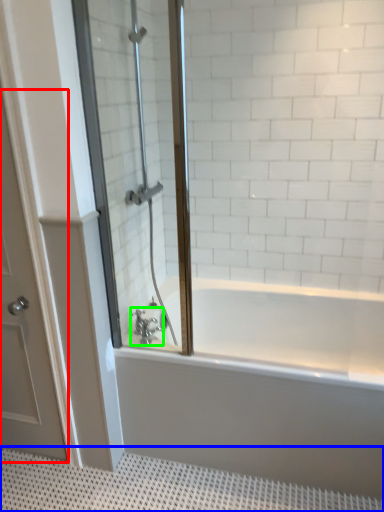
Question: Considering the real-world distances, which object is farthest from door (highlighted by a red box)? bath mat (highlighted by a blue box) or tap (highlighted by a green box)?

Choices:
 (A) bath mat
 (B) tap

Answer: (B)